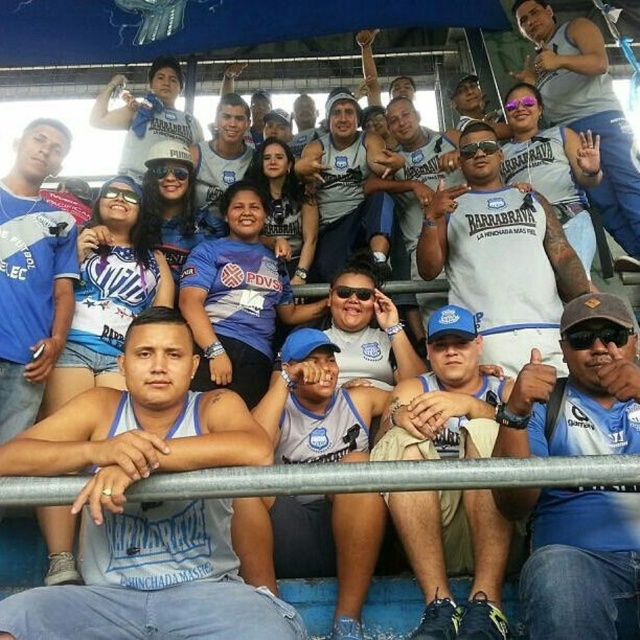
You are standing in the bleachers at the sports event and want to throw a paper airplane from point A to point B. Point A is at coordinate point (211, 518) and point B is at coordinate point (419, 520). Considering the spatial relationship between these two points, will the airplane fly towards the viewer or away from the viewer?

The airplane will fly away from the viewer because point A at coordinate point (211, 518) is closer to the viewer than point B at coordinate point (419, 520).